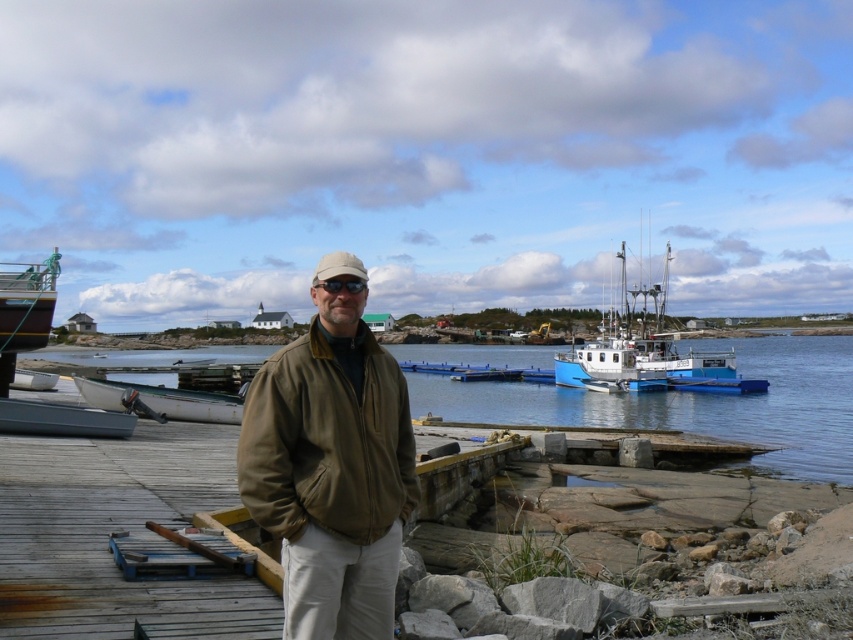
You are standing on the dock and want to walk to the point marked as point (x=346, y=259). However, there is an obstacle at point (x=132, y=484). Will you encounter this obstacle before reaching your destination?

Yes, you will encounter the obstacle at point (x=132, y=484) before reaching point (x=346, y=259) because point (x=132, y=484) is closer to you than point (x=346, y=259).

You are a photographer planning to capture the white matte boat at center and the beige fabric baseball cap at center in the same frame. Given their sizes, which object will appear bigger in your photo?

The white matte boat at center will appear bigger in the photo because it has a larger size compared to the beige fabric baseball cap at center.